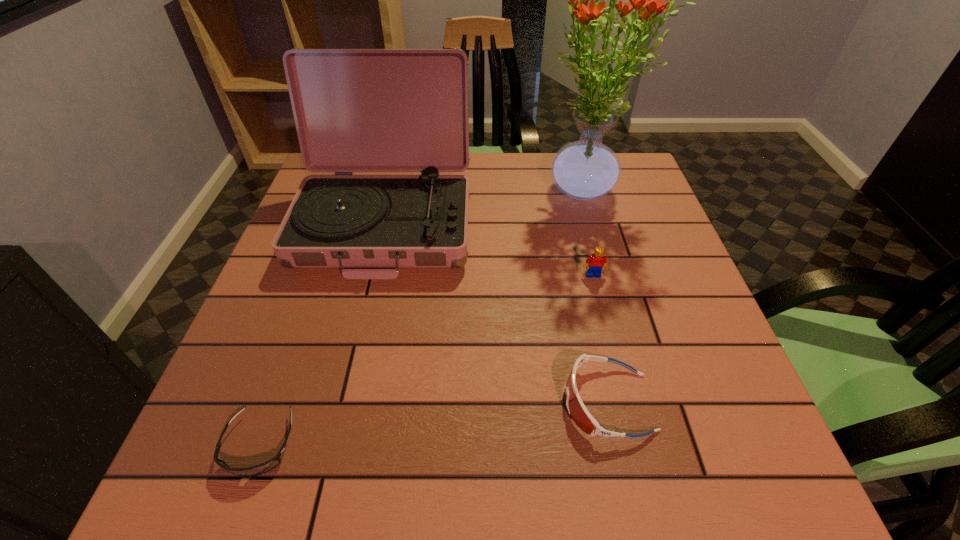
Identify the location of vacant region located on the front-facing side of the second shortest object. (355, 402).

Where is `free space located on the front-facing side of the second shortest object`? The image size is (960, 540). free space located on the front-facing side of the second shortest object is located at coordinates (470, 402).

Locate an element on the screen. vacant space located 0.330m on the front-facing side of the second shortest object is located at coordinates (372, 402).

Find the location of a particular element. flower arrangement that is at the far edge is located at coordinates (584, 170).

You are a GUI agent. You are given a task and a screenshot of the screen. Output one action in this format:
    pyautogui.click(x=<x>, y=<y>)
    Task: Click on the record player that is at the far edge
    
    Given the screenshot: What is the action you would take?
    pyautogui.click(x=356, y=110)

Where is `record player that is positioned at the left edge`? record player that is positioned at the left edge is located at coordinates (356, 110).

This screenshot has width=960, height=540. I want to click on goggles situated at the left edge, so click(262, 468).

Where is `flower arrangement that is at the right edge`? The image size is (960, 540). flower arrangement that is at the right edge is located at coordinates tap(584, 170).

Where is `goggles situated at the right edge`? The width and height of the screenshot is (960, 540). goggles situated at the right edge is located at coordinates (576, 408).

Identify the location of object situated at the far left corner. (356, 110).